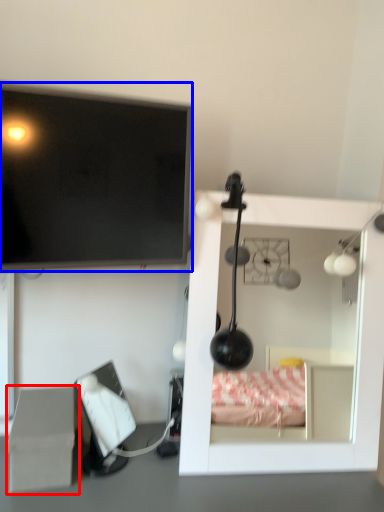
Question: Which of the following is the closest to the observer, cardboard box (highlighted by a red box) or television (highlighted by a blue box)?

Choices:
 (A) cardboard box
 (B) television

Answer: (B)